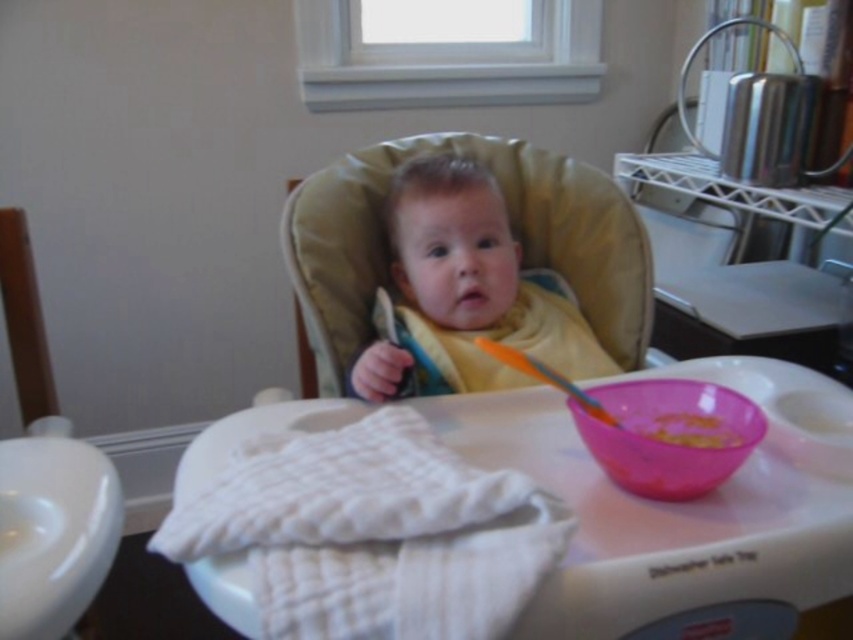
Question: Which of the following is the closest to the observer?

Choices:
 (A) (643, 433)
 (B) (659, 438)

Answer: (B)

Question: Which point is closer to the camera?

Choices:
 (A) soft yellow bib at center
 (B) orange plastic spoon at upper center
 (C) white fabric at lower left

Answer: (C)

Question: Does pink plastic bowl at lower center appear on the left side of yellow matte food at center?

Choices:
 (A) no
 (B) yes

Answer: (B)

Question: Which of the following is the closest to the observer?

Choices:
 (A) (392, 396)
 (B) (648, 460)
 (C) (27, 600)
 (D) (727, 444)

Answer: (C)

Question: Can you confirm if soft yellow bib at center is thinner than orange plastic spoon at upper center?

Choices:
 (A) no
 (B) yes

Answer: (A)

Question: Can you confirm if soft yellow bib at center is positioned below pink plastic bowl at lower center?

Choices:
 (A) no
 (B) yes

Answer: (A)